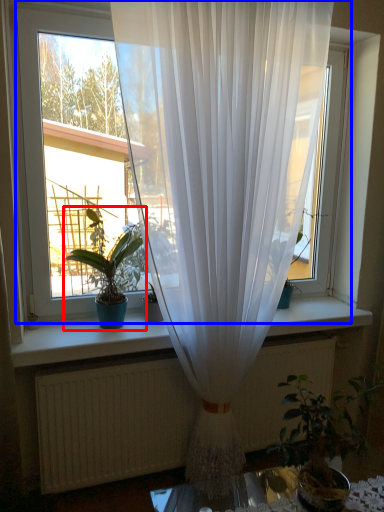
Question: Which point is further to the camera, houseplant (highlighted by a red box) or window (highlighted by a blue box)?

Choices:
 (A) houseplant
 (B) window

Answer: (A)